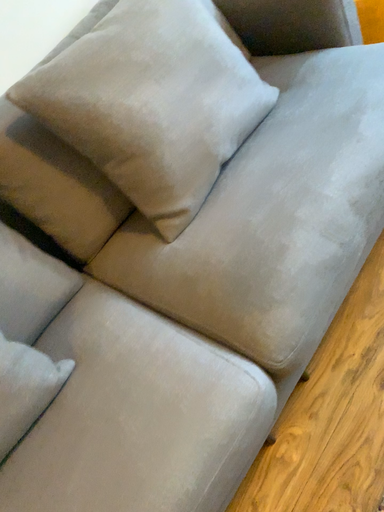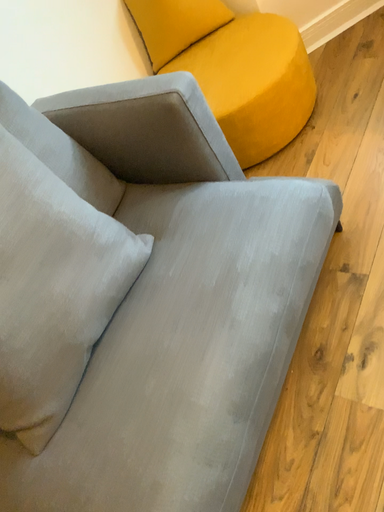
Question: How did the camera likely rotate when shooting the video?

Choices:
 (A) rotated right
 (B) rotated left

Answer: (A)